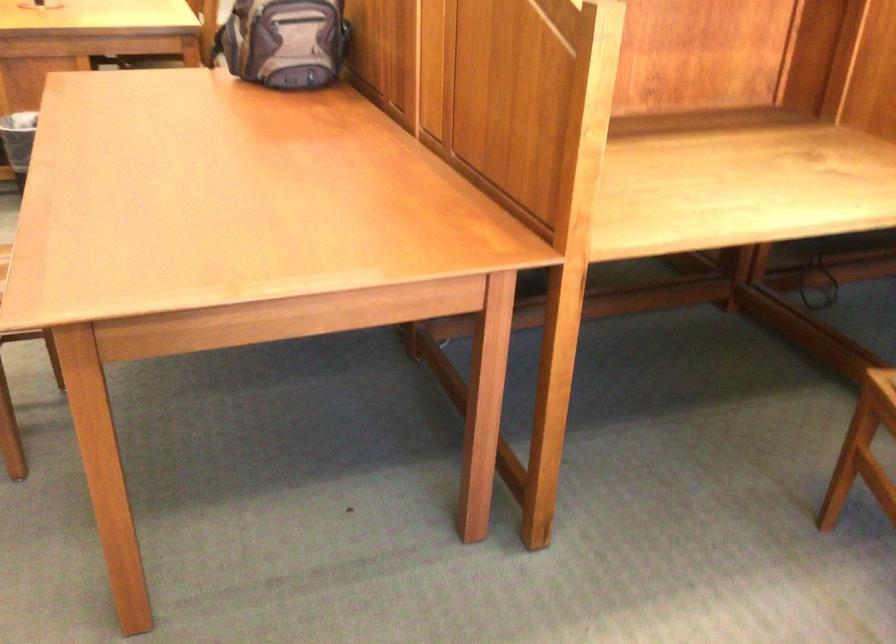
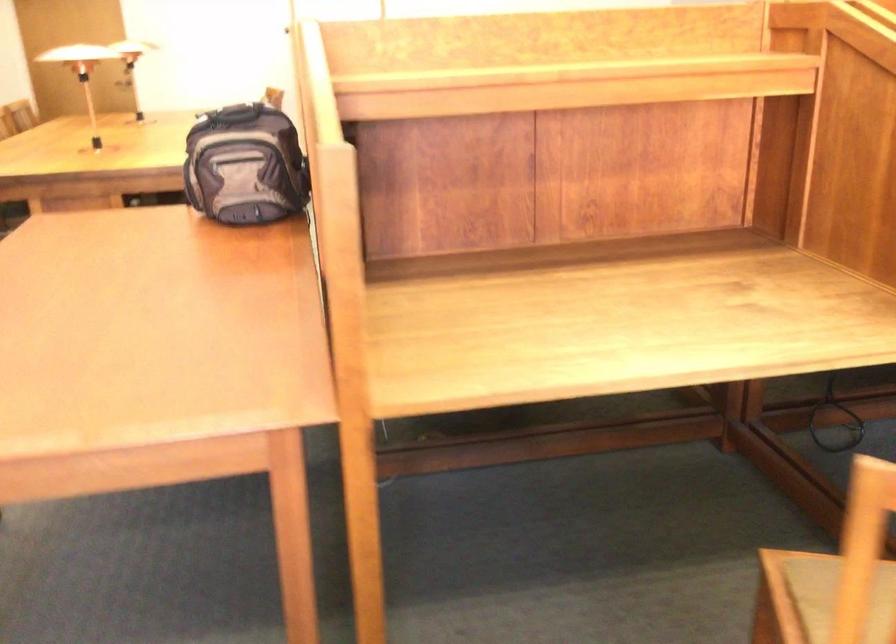
Question: The camera is either moving clockwise (left) or counter-clockwise (right) around the object. The first image is from the beginning of the video and the second image is from the end. Is the camera moving left or right when shooting the video?

Choices:
 (A) Left
 (B) Right

Answer: (B)